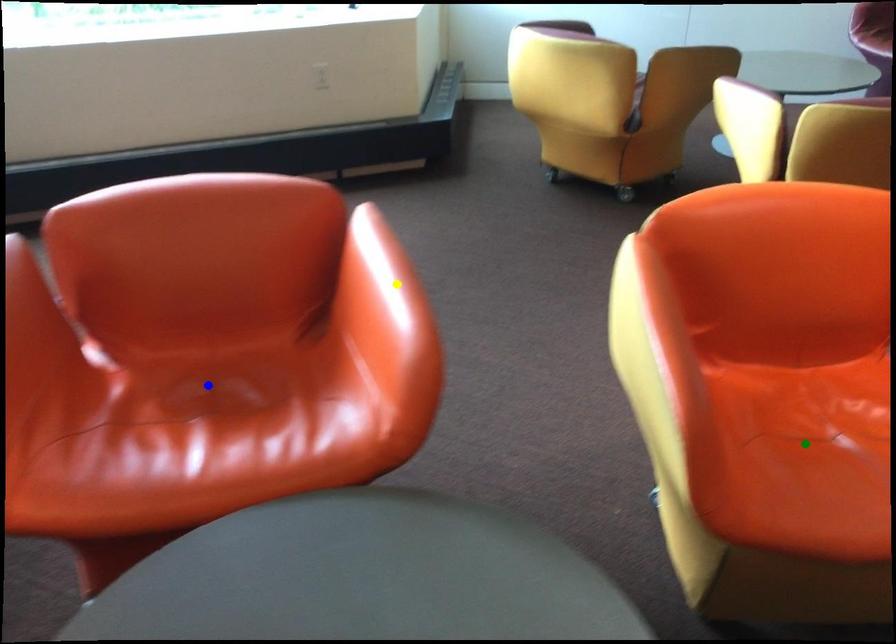
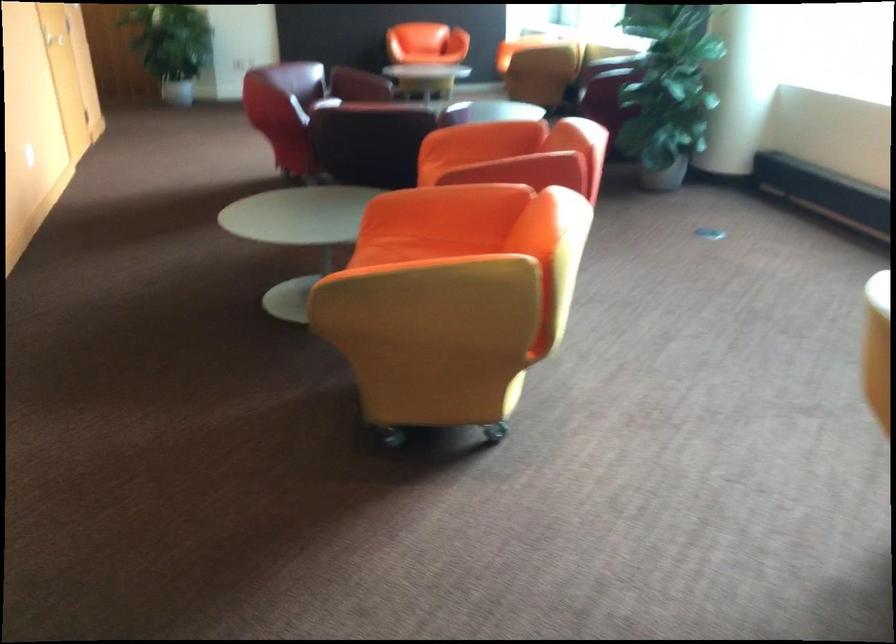
I am providing you with two images of the same scene from different viewpoints. Three points are marked in image1. Which point corresponds to a part or object that is occluded in image2?In image1, three points are marked. Which of them correspond to a part or object that is occluded in image2?Among the three points shown in image1, which one corresponds to a part or object that is no longer visible due to occlusion in image2?

Invisible in image2: blue point, yellow point, green point.